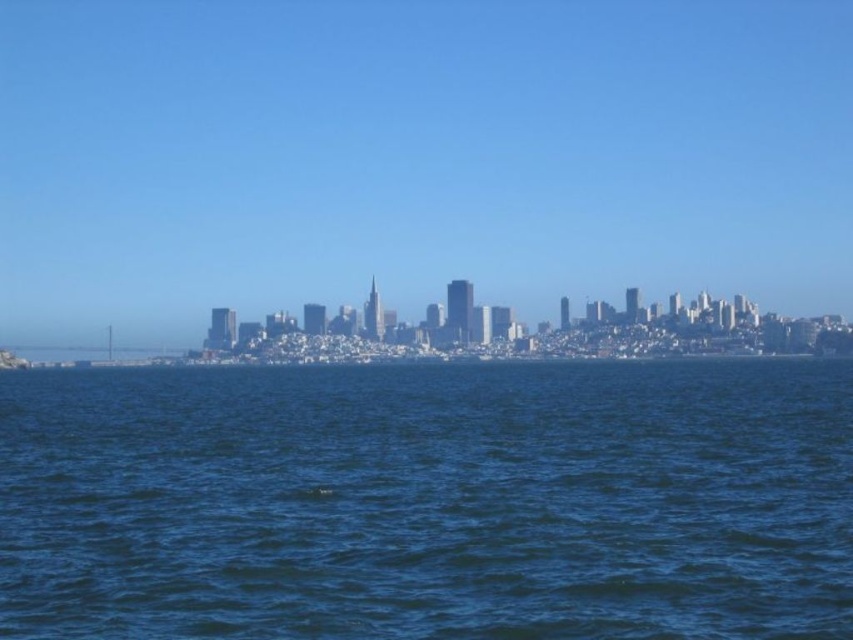
You are a photographer planning to capture the city skyline. You notice the transparent glass skyline at center and the dark blue water at center in your viewfinder. Which object should you focus on to ensure the skyline is sharp in your photo?

The transparent glass skyline at center is located above the dark blue water at center, so focusing on the skyline will ensure it appears sharp in the photo since it is the primary subject and positioned higher in the frame.

Based on the photo, you are a photographer planning to capture the city skyline. You notice the transparent glass skyline at center and the dark blue water at center in your viewfinder. Which object will occupy more space in your photo?

The transparent glass skyline at center is larger in size than the dark blue water at center, so it will occupy more space in the photo.

In the scene shown: You are standing at the edge of the water in the city skyline image. You see two points marked in the scene. If you want to reach point (741, 29) and point (18, 592), which one would you physically reach first?

You would reach point (741, 29) first because it is closer to you than point (18, 592), which is further away.